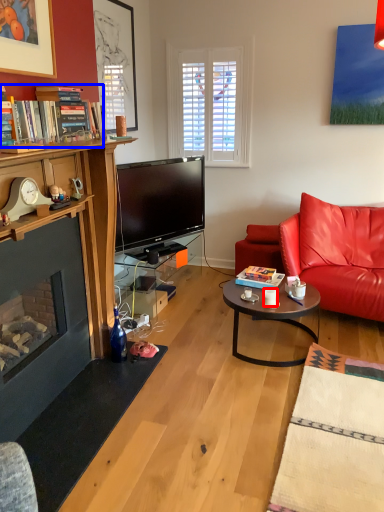
Question: Which object appears closest to the camera in this image, coffee cup (highlighted by a red box) or book (highlighted by a blue box)?

Choices:
 (A) coffee cup
 (B) book

Answer: (B)